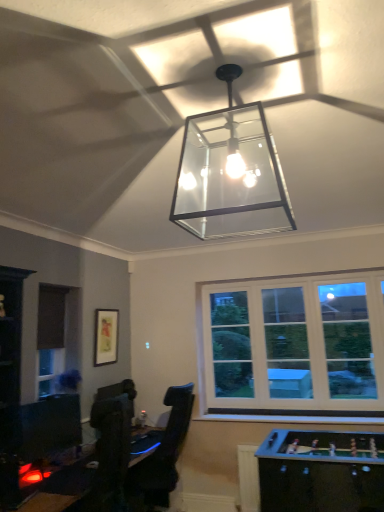
In order to face clear glass pendant light at center, should I rotate leftwards or rightwards?

You should look right and rotate roughly 5.090 degrees.

Describe the element at coordinates (50, 425) in the screenshot. I see `matte black monitor at lower left` at that location.

Describe the element at coordinates (320, 472) in the screenshot. This screenshot has width=384, height=512. I see `wooden foosball table at lower right, placed as the first table when sorted from right to left` at that location.

Identify the location of clear glass pendant light at center. The image size is (384, 512). coord(230,173).

Is matte black picture frame at upper left to the left of black glossy table at lower left, which appears as the 2th table when viewed from the right, from the viewer's perspective?

Yes.

What's the angular difference between matte black picture frame at upper left and black glossy table at lower left, the 1th table when ordered from left to right,'s facing directions?

0.00211 degrees separate the facing orientations of matte black picture frame at upper left and black glossy table at lower left, the 1th table when ordered from left to right.

Are matte black picture frame at upper left and black glossy table at lower left, which appears as the 2th table when viewed from the right, located far from each other?

That's right, there is a large distance between matte black picture frame at upper left and black glossy table at lower left, which appears as the 2th table when viewed from the right.

In the scene shown: Between matte black picture frame at upper left and black glossy table at lower left, which appears as the 2th table when viewed from the right, which one has larger size?

black glossy table at lower left, which appears as the 2th table when viewed from the right.

How different are the orientations of wooden foosball table at lower right, placed as the first table when sorted from right to left, and matte black picture frame at upper left in degrees?

There is a 86.7-degree angle between the facing directions of wooden foosball table at lower right, placed as the first table when sorted from right to left, and matte black picture frame at upper left.

Does wooden foosball table at lower right, which ranks as the 2th table in left-to-right order, have a larger size compared to matte black picture frame at upper left?

Correct, wooden foosball table at lower right, which ranks as the 2th table in left-to-right order, is larger in size than matte black picture frame at upper left.

Does wooden foosball table at lower right, which ranks as the 2th table in left-to-right order, turn towards matte black picture frame at upper left?

No, wooden foosball table at lower right, which ranks as the 2th table in left-to-right order, is not turned towards matte black picture frame at upper left.

Considering the sizes of wooden foosball table at lower right, placed as the first table when sorted from right to left, and matte black picture frame at upper left in the image, is wooden foosball table at lower right, placed as the first table when sorted from right to left, wider or thinner than matte black picture frame at upper left?

Clearly, wooden foosball table at lower right, placed as the first table when sorted from right to left, has more width compared to matte black picture frame at upper left.

What are the coordinates of `lamp in front of the wooden foosball table at lower right, placed as the first table when sorted from right to left` in the screenshot? It's located at (230, 173).

From the picture: From the image's perspective, is clear glass pendant light at center located beneath wooden foosball table at lower right, placed as the first table when sorted from right to left?

No, from the image's perspective, clear glass pendant light at center is not below wooden foosball table at lower right, placed as the first table when sorted from right to left.

Does clear glass pendant light at center have a smaller size compared to wooden foosball table at lower right, placed as the first table when sorted from right to left?

Indeed, clear glass pendant light at center has a smaller size compared to wooden foosball table at lower right, placed as the first table when sorted from right to left.

Looking at this image, looking at their sizes, would you say clear glass pendant light at center is wider or thinner than wooden foosball table at lower right, placed as the first table when sorted from right to left?

clear glass pendant light at center is wider than wooden foosball table at lower right, placed as the first table when sorted from right to left.

Is the surface of wooden foosball table at lower right, placed as the first table when sorted from right to left, in direct contact with black glossy table at lower left, which appears as the 2th table when viewed from the right?

wooden foosball table at lower right, placed as the first table when sorted from right to left, and black glossy table at lower left, which appears as the 2th table when viewed from the right, are clearly separated.

Where is `table below the black glossy table at lower left, which appears as the 2th table when viewed from the right (from the image's perspective)`? table below the black glossy table at lower left, which appears as the 2th table when viewed from the right (from the image's perspective) is located at coordinates (320, 472).

Considering the sizes of wooden foosball table at lower right, placed as the first table when sorted from right to left, and black glossy table at lower left, which appears as the 2th table when viewed from the right, in the image, is wooden foosball table at lower right, placed as the first table when sorted from right to left, taller or shorter than black glossy table at lower left, which appears as the 2th table when viewed from the right,?

Considering their sizes, wooden foosball table at lower right, placed as the first table when sorted from right to left, has more height than black glossy table at lower left, which appears as the 2th table when viewed from the right.

Considering the relative sizes of wooden foosball table at lower right, which ranks as the 2th table in left-to-right order, and black glossy table at lower left, which appears as the 2th table when viewed from the right, in the image provided, is wooden foosball table at lower right, which ranks as the 2th table in left-to-right order, bigger than black glossy table at lower left, which appears as the 2th table when viewed from the right,?

Indeed, wooden foosball table at lower right, which ranks as the 2th table in left-to-right order, has a larger size compared to black glossy table at lower left, which appears as the 2th table when viewed from the right.

Are matte black picture frame at upper left and wooden foosball table at lower right, placed as the first table when sorted from right to left, far apart?

Yes, matte black picture frame at upper left and wooden foosball table at lower right, placed as the first table when sorted from right to left, are quite far apart.

Is matte black picture frame at upper left wider or thinner than wooden foosball table at lower right, placed as the first table when sorted from right to left?

matte black picture frame at upper left is thinner than wooden foosball table at lower right, placed as the first table when sorted from right to left.

Considering the relative positions of matte black picture frame at upper left and wooden foosball table at lower right, which ranks as the 2th table in left-to-right order, in the image provided, is matte black picture frame at upper left in front of wooden foosball table at lower right, which ranks as the 2th table in left-to-right order,?

No, matte black picture frame at upper left is further to the viewer.

From the image's perspective, count 2nd tables downward from the matte black picture frame at upper left and point to it. Please provide its 2D coordinates.

[(320, 472)]

Considering the sizes of objects black glossy table at lower left, which appears as the 2th table when viewed from the right, and matte black monitor at lower left in the image provided, who is shorter, black glossy table at lower left, which appears as the 2th table when viewed from the right, or matte black monitor at lower left?

Standing shorter between the two is black glossy table at lower left, which appears as the 2th table when viewed from the right.

Is the position of black glossy table at lower left, the 1th table when ordered from left to right, more distant than that of matte black monitor at lower left?

No, it is not.

Does black glossy table at lower left, which appears as the 2th table when viewed from the right, have a lesser width compared to matte black monitor at lower left?

No.

Does black glossy table at lower left, which appears as the 2th table when viewed from the right, have a smaller size compared to matte black monitor at lower left?

Actually, black glossy table at lower left, which appears as the 2th table when viewed from the right, might be larger than matte black monitor at lower left.

Between point (69, 408) and point (260, 492), which one is positioned behind?

The point (69, 408) is behind.

In the scene shown: Is matte black monitor at lower left bigger or smaller than wooden foosball table at lower right, which ranks as the 2th table in left-to-right order?

Considering their sizes, matte black monitor at lower left takes up less space than wooden foosball table at lower right, which ranks as the 2th table in left-to-right order.

Does matte black monitor at lower left come in front of wooden foosball table at lower right, which ranks as the 2th table in left-to-right order?

Yes, it is.

Is matte black monitor at lower left oriented away from wooden foosball table at lower right, which ranks as the 2th table in left-to-right order?

No, matte black monitor at lower left is not facing the opposite direction of wooden foosball table at lower right, which ranks as the 2th table in left-to-right order.

Locate an element on the screen. Image resolution: width=384 pixels, height=512 pixels. the 1st table counting from the right of the matte black picture frame at upper left is located at coordinates (48, 502).

Find the location of a particular element. Image resolution: width=384 pixels, height=512 pixels. the 2nd table positioned below the matte black picture frame at upper left (from a real-world perspective) is located at coordinates tap(320, 472).

Considering their positions, is black glossy table at lower left, which appears as the 2th table when viewed from the right, positioned further to matte black monitor at lower left than matte black picture frame at upper left?

matte black picture frame at upper left is positioned further to the anchor matte black monitor at lower left.

Based on their spatial positions, is matte black picture frame at upper left or clear glass pendant light at center further from black glossy table at lower left, the 1th table when ordered from left to right?

clear glass pendant light at center.

When comparing their distances from matte black picture frame at upper left, does matte black monitor at lower left or black glossy table at lower left, the 1th table when ordered from left to right, seem further?

black glossy table at lower left, the 1th table when ordered from left to right, is further to matte black picture frame at upper left.

When comparing their distances from wooden foosball table at lower right, which ranks as the 2th table in left-to-right order, does matte black monitor at lower left or black glossy table at lower left, the 1th table when ordered from left to right, seem further?

black glossy table at lower left, the 1th table when ordered from left to right, is further to wooden foosball table at lower right, which ranks as the 2th table in left-to-right order.

Looking at the image, which one is located further to black glossy table at lower left, the 1th table when ordered from left to right, clear glass pendant light at center or wooden foosball table at lower right, placed as the first table when sorted from right to left?

Based on the image, clear glass pendant light at center appears to be further to black glossy table at lower left, the 1th table when ordered from left to right.

Looking at the image, which one is located further to matte black picture frame at upper left, black glossy table at lower left, which appears as the 2th table when viewed from the right, or matte black monitor at lower left?

black glossy table at lower left, which appears as the 2th table when viewed from the right, lies further to matte black picture frame at upper left than the other object.

Based on their spatial positions, is clear glass pendant light at center or black glossy table at lower left, which appears as the 2th table when viewed from the right, further from matte black monitor at lower left?

clear glass pendant light at center is positioned further to the anchor matte black monitor at lower left.

Considering their positions, is matte black picture frame at upper left positioned further to matte black monitor at lower left than wooden foosball table at lower right, placed as the first table when sorted from right to left?

wooden foosball table at lower right, placed as the first table when sorted from right to left, is further to matte black monitor at lower left.

Identify the location of computer monitor between clear glass pendant light at center and matte black picture frame at upper left along the z-axis. This screenshot has width=384, height=512. (50, 425).

You are a GUI agent. You are given a task and a screenshot of the screen. Output one action in this format:
    pyautogui.click(x=<x>, y=<y>)
    Task: Click on the computer monitor between clear glass pendant light at center and wooden foosball table at lower right, which ranks as the 2th table in left-to-right order, in the up-down direction
    
    Given the screenshot: What is the action you would take?
    pyautogui.click(x=50, y=425)

I want to click on table between clear glass pendant light at center and wooden foosball table at lower right, placed as the first table when sorted from right to left, in the up-down direction, so click(48, 502).

This screenshot has height=512, width=384. I want to click on picture frame between matte black monitor at lower left and wooden foosball table at lower right, which ranks as the 2th table in left-to-right order, in the horizontal direction, so click(x=106, y=336).